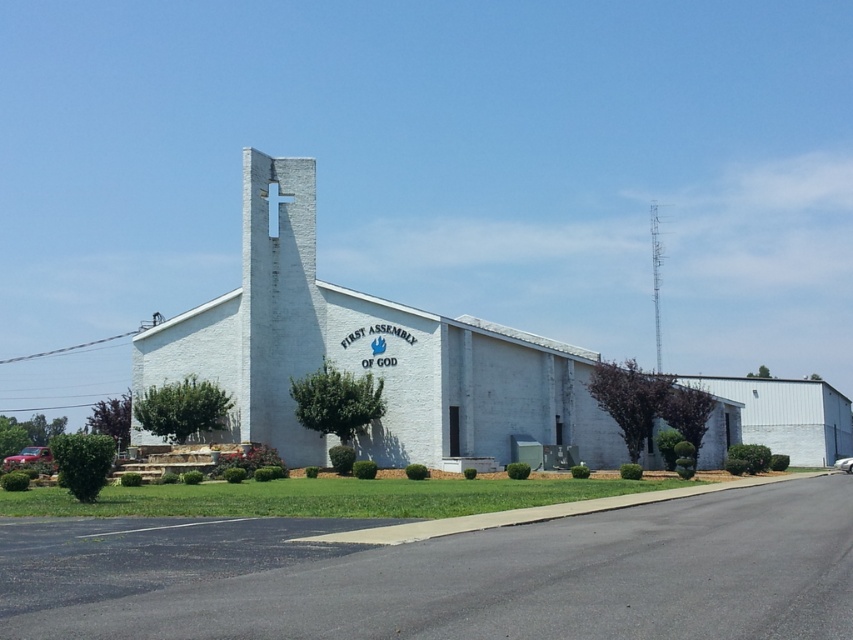
Question: Which point is farther to the camera?

Choices:
 (A) (653, 202)
 (B) (459, 355)

Answer: (A)

Question: Which of the following is the farthest from the observer?

Choices:
 (A) white brick chapel at center
 (B) metallic silver tower at upper right

Answer: (B)

Question: Considering the relative positions of white brick chapel at center and metallic silver tower at upper right in the image provided, where is white brick chapel at center located with respect to metallic silver tower at upper right?

Choices:
 (A) above
 (B) below

Answer: (B)

Question: Which point appears closest to the camera in this image?

Choices:
 (A) (310, 291)
 (B) (659, 312)

Answer: (A)

Question: Is white brick chapel at center above metallic silver tower at upper right?

Choices:
 (A) no
 (B) yes

Answer: (A)

Question: Can you confirm if white brick chapel at center is positioned to the right of metallic silver tower at upper right?

Choices:
 (A) yes
 (B) no

Answer: (B)